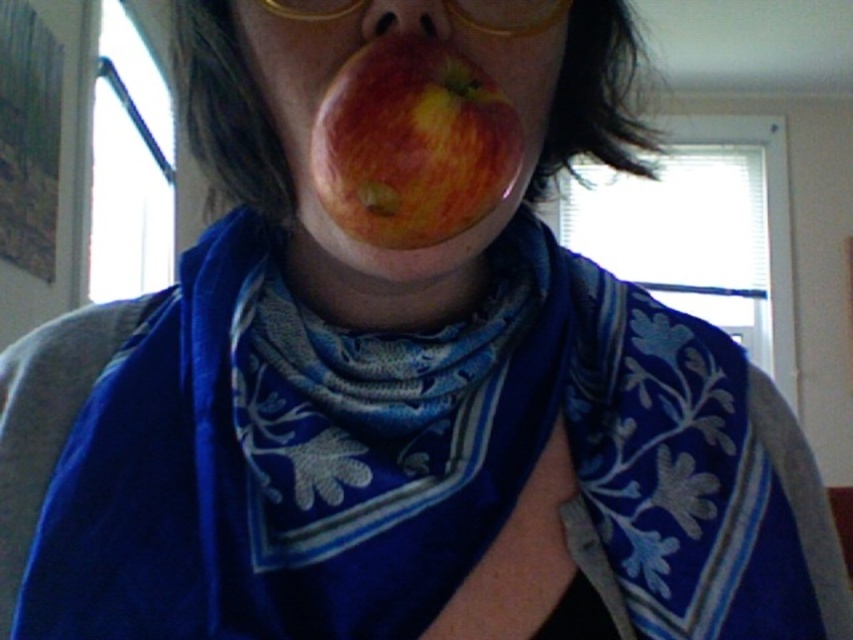
Please describe the location of the shiny red apple at center in the image using coordinates. The coordinate system has the origin at the bottom left corner of the image, with the x and y axes increasing to the right and up respectively. The maximum x and y values are both 1.0. Please provide the coordinates as a pair of numbers between 0 and 1 separated by a comma.

The shiny red apple at center is located at coordinates point (339, 67).

You are a delivery person who needs to place a red matte apple at center and gold plastic glasses at upper center on a shelf. The shelf has a width of 10 cm. Can both items fit side by side without overlapping?

The red matte apple at center is thinner than gold plastic glasses at upper center. However, since the total width of both items combined is not provided, it is impossible to determine if they can fit side by side on a 10 cm shelf without overlapping.